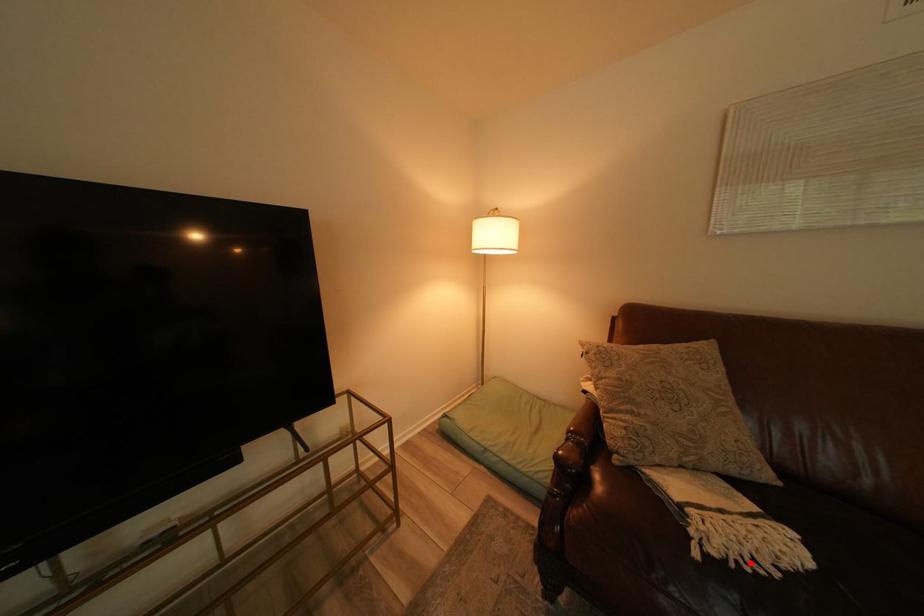
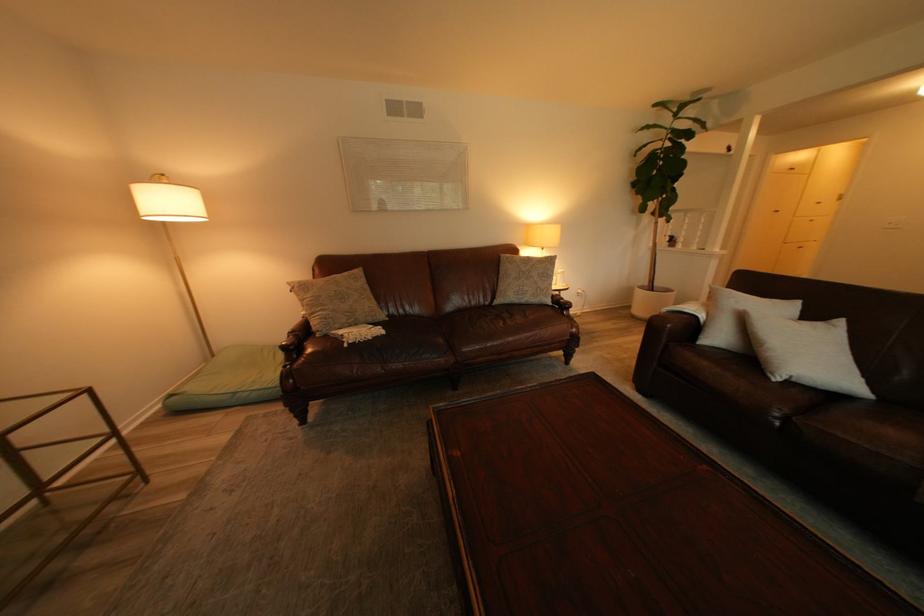
Locate, in the second image, the point that corresponds to the highlighted location in the first image.

(372, 342)